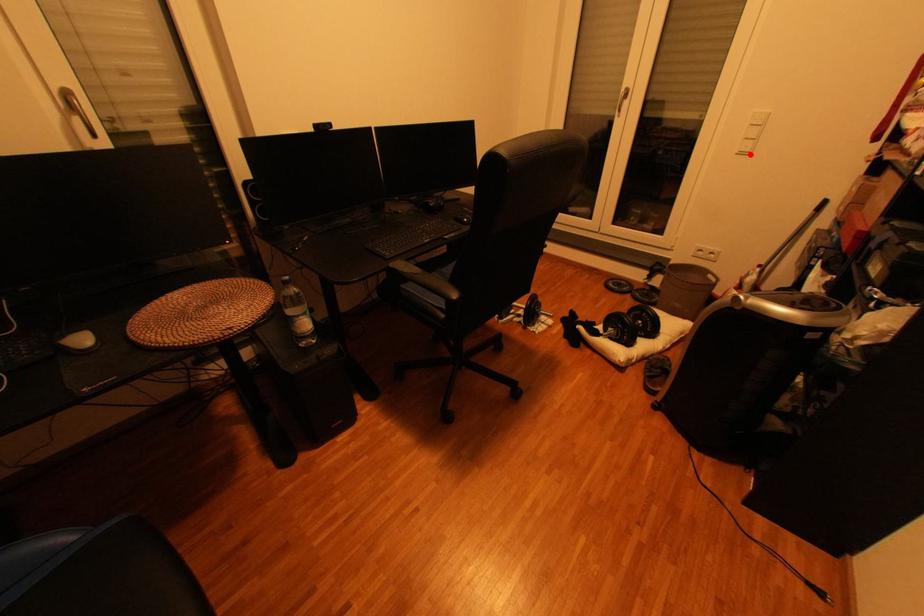
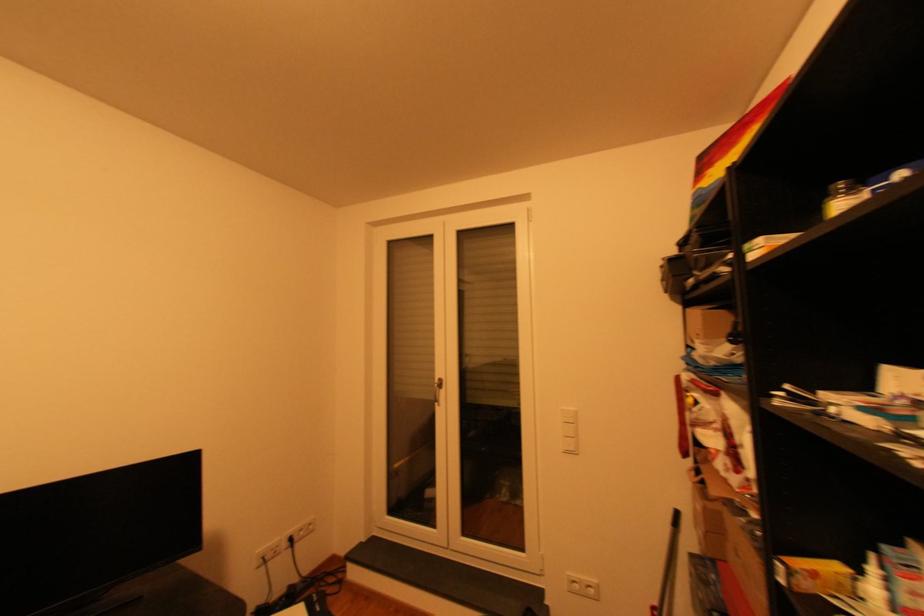
Locate, in the second image, the point that corresponds to the highlighted location in the first image.

(576, 453)